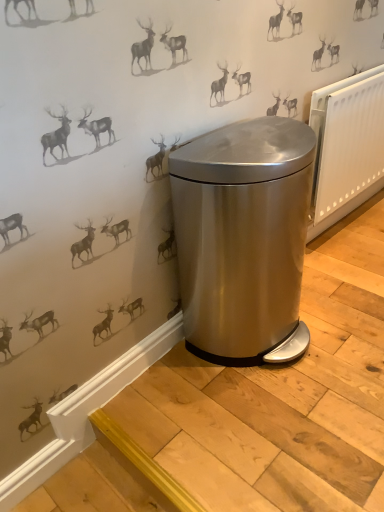
Image resolution: width=384 pixels, height=512 pixels. I want to click on vacant space underneath white plastic radiator at right (from a real-world perspective), so click(352, 221).